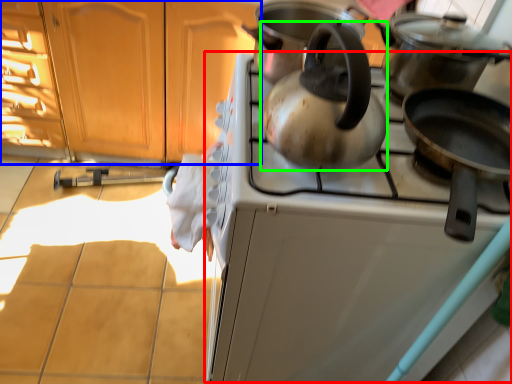
Question: Which object is the closest to the oven (highlighted by a red box)? Choose among these: cabinetry (highlighted by a blue box) or kettle (highlighted by a green box).

Choices:
 (A) cabinetry
 (B) kettle

Answer: (B)